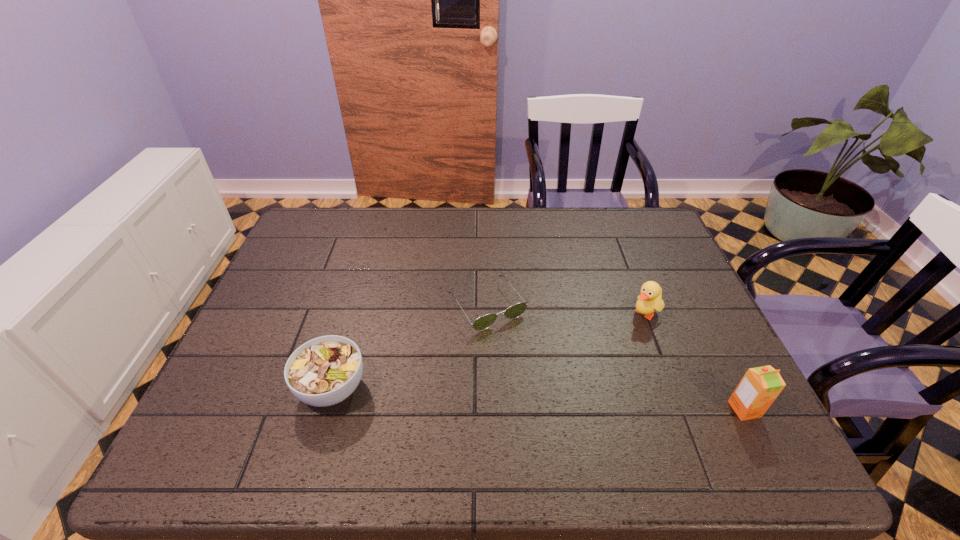
Where is `free space between the third object from right to left and the soup bowl`? This screenshot has height=540, width=960. free space between the third object from right to left and the soup bowl is located at coordinates (410, 347).

Where is `vacant space that is in between the shortest object and the leftmost object`? vacant space that is in between the shortest object and the leftmost object is located at coordinates pyautogui.click(x=410, y=347).

You are a GUI agent. You are given a task and a screenshot of the screen. Output one action in this format:
    pyautogui.click(x=<x>, y=<y>)
    Task: Click on the free space that is in between the rightmost object and the third tallest object
    
    Given the screenshot: What is the action you would take?
    pyautogui.click(x=539, y=399)

This screenshot has height=540, width=960. Identify the location of free space that is in between the third tallest object and the shortest object. (410, 347).

Find the location of `empty space that is in between the rightmost object and the third object from right to left`. empty space that is in between the rightmost object and the third object from right to left is located at coordinates (615, 357).

Where is `vacant area that lies between the third shortest object and the shortest object`? The height and width of the screenshot is (540, 960). vacant area that lies between the third shortest object and the shortest object is located at coordinates (565, 309).

Locate an element on the screen. The height and width of the screenshot is (540, 960). vacant space that's between the shortest object and the third shortest object is located at coordinates (565, 309).

The height and width of the screenshot is (540, 960). What are the coordinates of `object that is the closest one to the leftmost object` in the screenshot? It's located at (484, 322).

Identify the location of the closest object relative to the rightmost object. The image size is (960, 540). (650, 299).

Locate an element on the screen. This screenshot has width=960, height=540. vacant space that satisfies the following two spatial constraints: 1. on the front side of the duckling; 2. on the left side of the orange juice is located at coordinates tap(681, 409).